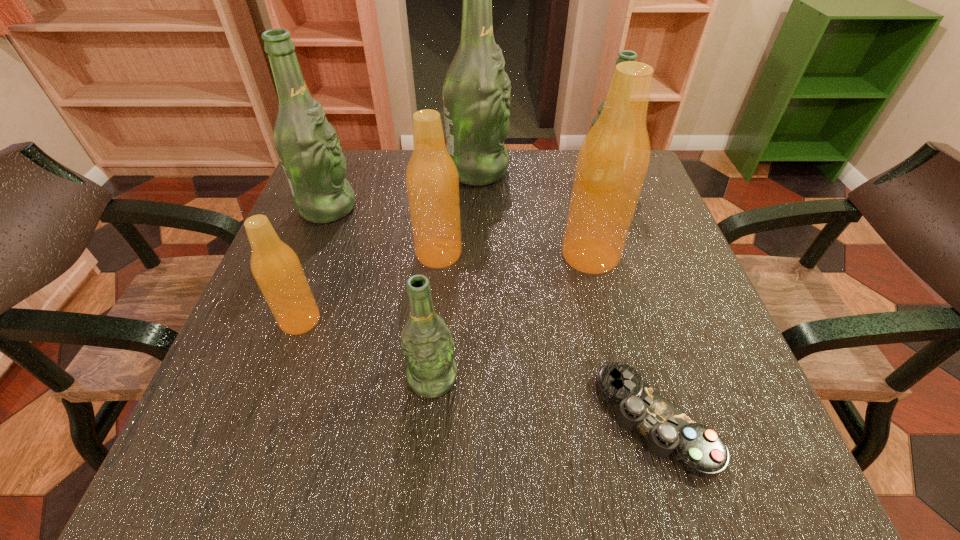
You are a GUI agent. You are given a task and a screenshot of the screen. Output one action in this format:
    pyautogui.click(x=<x>, y=<y>)
    Task: Click on the vacant space situated on the back of the shortest object
    
    Given the screenshot: What is the action you would take?
    click(601, 237)

Find the location of a particular element. This screenshot has height=540, width=960. object present at the near edge is located at coordinates (700, 450).

Where is `control that is at the right edge`? This screenshot has width=960, height=540. control that is at the right edge is located at coordinates (700, 450).

This screenshot has height=540, width=960. Find the location of `object situated at the far left corner`. object situated at the far left corner is located at coordinates (308, 147).

Image resolution: width=960 pixels, height=540 pixels. In order to click on object situated at the far right corner in this screenshot , I will do `click(626, 55)`.

Image resolution: width=960 pixels, height=540 pixels. I want to click on object located in the near right corner section of the desktop, so click(x=700, y=450).

This screenshot has height=540, width=960. Find the location of `vacant area at the far edge of the desktop`. vacant area at the far edge of the desktop is located at coordinates (501, 195).

The image size is (960, 540). I want to click on free space at the near edge of the desktop, so click(x=510, y=453).

This screenshot has height=540, width=960. Identify the location of blank space at the left edge of the desktop. (304, 393).

The width and height of the screenshot is (960, 540). In the image, there is a desktop. Identify the location of free region at the right edge. (653, 365).